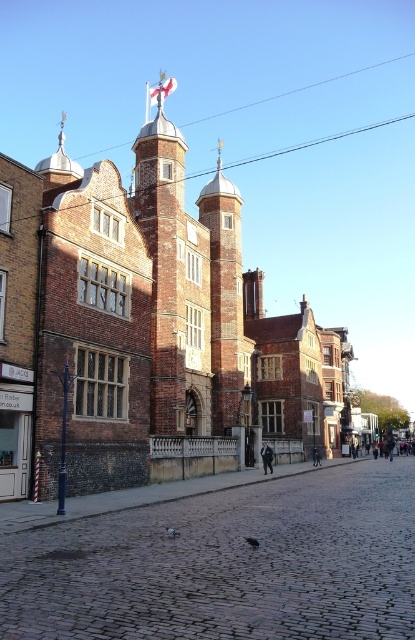
Question: Is brick bell tower at center positioned at the back of dark blue jeans at center?

Choices:
 (A) no
 (B) yes

Answer: (B)

Question: Which object appears closest to the camera in this image?

Choices:
 (A) brick bell tower at center
 (B) dark blue jeans at center

Answer: (B)

Question: Among these objects, which one is farthest from the camera?

Choices:
 (A) dark blue jeans at center
 (B) brick bell tower at center

Answer: (B)

Question: In this image, where is brick bell tower at center located relative to dark blue jeans at center?

Choices:
 (A) left
 (B) right

Answer: (A)

Question: Is the position of brick bell tower at center more distant than that of dark blue jeans at center?

Choices:
 (A) yes
 (B) no

Answer: (A)

Question: Which of the following is the closest to the observer?

Choices:
 (A) (266, 461)
 (B) (202, 218)

Answer: (A)